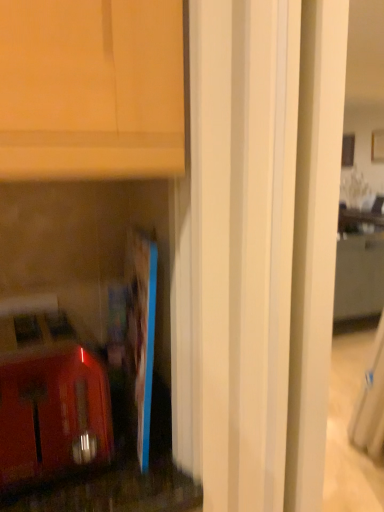
What is the approximate width of shiny metallic train at lower left?

The width of shiny metallic train at lower left is 7.34 inches.

The image size is (384, 512). Find the location of `shiny metallic train at lower left`. shiny metallic train at lower left is located at coordinates (52, 414).

The height and width of the screenshot is (512, 384). What do you see at coordinates (52, 414) in the screenshot?
I see `shiny metallic train at lower left` at bounding box center [52, 414].

Locate an element on the screen. This screenshot has width=384, height=512. shiny metallic train at lower left is located at coordinates (52, 414).